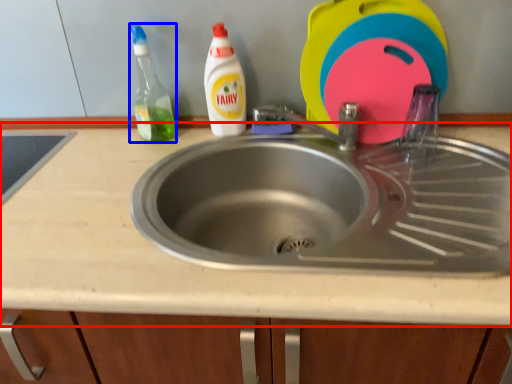
Question: Which of the following is the closest to the observer, countertop (highlighted by a red box) or cleaning product (highlighted by a blue box)?

Choices:
 (A) countertop
 (B) cleaning product

Answer: (A)